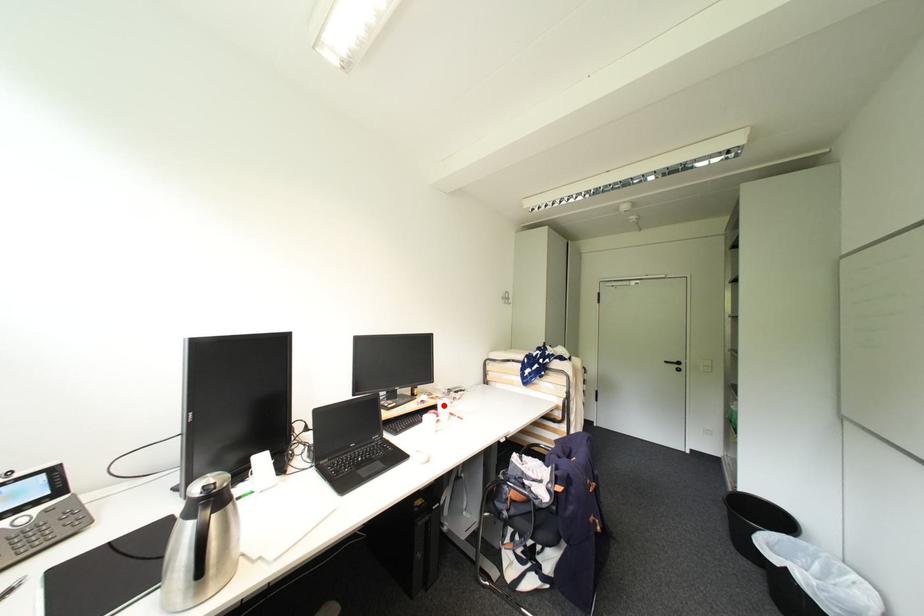
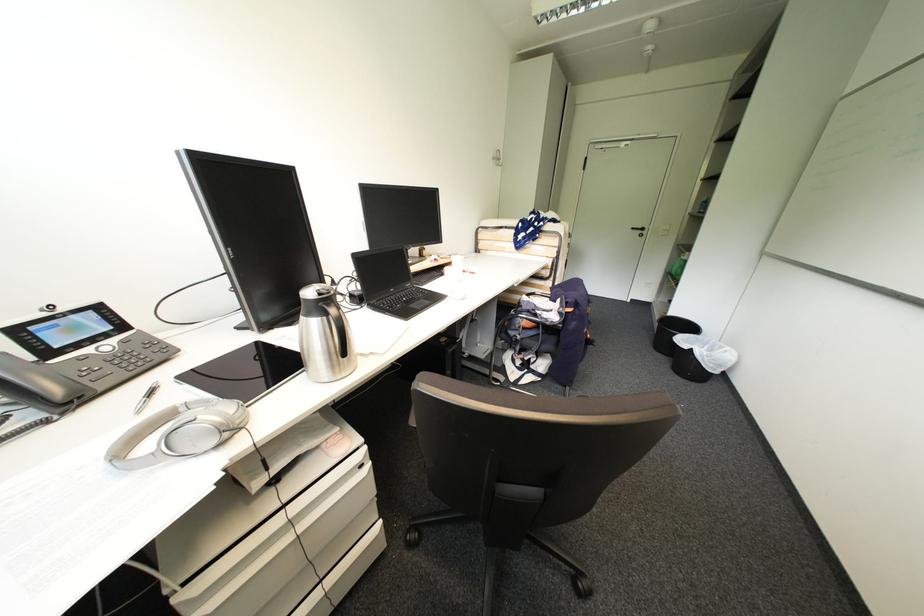
Locate, in the second image, the point that corresponds to the highlighted location in the first image.

(456, 262)